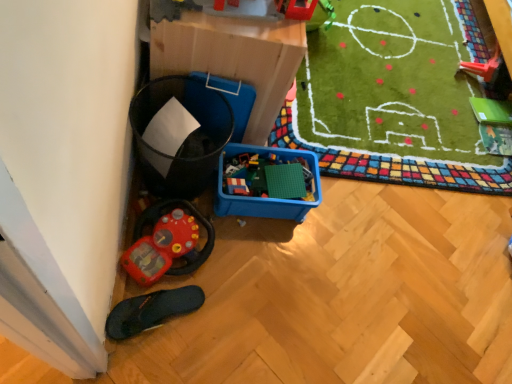
Question: Does black rubber slipper at lower left have a larger size compared to rubberized plastic toy at upper right, positioned as the third toy in left-to-right order?

Choices:
 (A) yes
 (B) no

Answer: (A)

Question: From a real-world perspective, is black rubber slipper at lower left under rubberized plastic toy at upper right, the 1th toy positioned from the right?

Choices:
 (A) yes
 (B) no

Answer: (A)

Question: Is black rubber slipper at lower left shorter than rubberized plastic toy at upper right, acting as the 1th toy starting from the top?

Choices:
 (A) no
 (B) yes

Answer: (B)

Question: Is black rubber slipper at lower left facing away from rubberized plastic toy at upper right, acting as the third toy starting from the bottom?

Choices:
 (A) no
 (B) yes

Answer: (A)

Question: Does black rubber slipper at lower left have a smaller size compared to rubberized plastic toy at upper right, acting as the third toy starting from the bottom?

Choices:
 (A) no
 (B) yes

Answer: (A)

Question: In terms of size, does blue plastic storage box at lower left appear bigger or smaller than black rubber slipper at lower left?

Choices:
 (A) big
 (B) small

Answer: (A)

Question: In terms of height, does blue plastic storage box at lower left look taller or shorter compared to black rubber slipper at lower left?

Choices:
 (A) tall
 (B) short

Answer: (A)

Question: From the image's perspective, relative to black rubber slipper at lower left, is blue plastic storage box at lower left above or below?

Choices:
 (A) above
 (B) below

Answer: (A)

Question: Relative to black rubber slipper at lower left, is blue plastic storage box at lower left in front or behind?

Choices:
 (A) behind
 (B) front

Answer: (B)

Question: Based on their positions, is black rubber slipper at lower left located to the left or right of rubberized plastic toy at upper right, arranged as the 1th toy when viewed from the back?

Choices:
 (A) left
 (B) right

Answer: (A)

Question: Is black rubber slipper at lower left bigger or smaller than rubberized plastic toy at upper right, the 1th toy positioned from the right?

Choices:
 (A) big
 (B) small

Answer: (A)

Question: From the image's perspective, is black rubber slipper at lower left positioned above or below rubberized plastic toy at upper right, the 1th toy positioned from the right?

Choices:
 (A) above
 (B) below

Answer: (B)

Question: Looking at their shapes, would you say black rubber slipper at lower left is wider or thinner than rubberized plastic toy at upper right, arranged as the 1th toy when viewed from the back?

Choices:
 (A) wide
 (B) thin

Answer: (A)

Question: Is point (214, 51) closer or farther from the camera than point (173, 243)?

Choices:
 (A) closer
 (B) farther

Answer: (A)

Question: From their relative heights in the image, would you say blue plastic storage box at lower left is taller or shorter than rubberized red toy car at lower left, which is counted as the 2th toy, starting from the back?

Choices:
 (A) tall
 (B) short

Answer: (A)